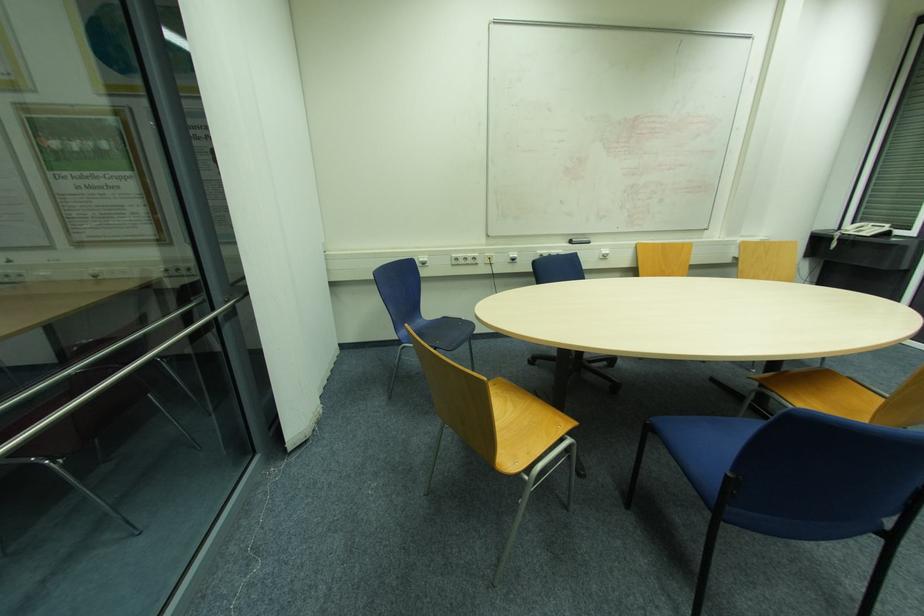
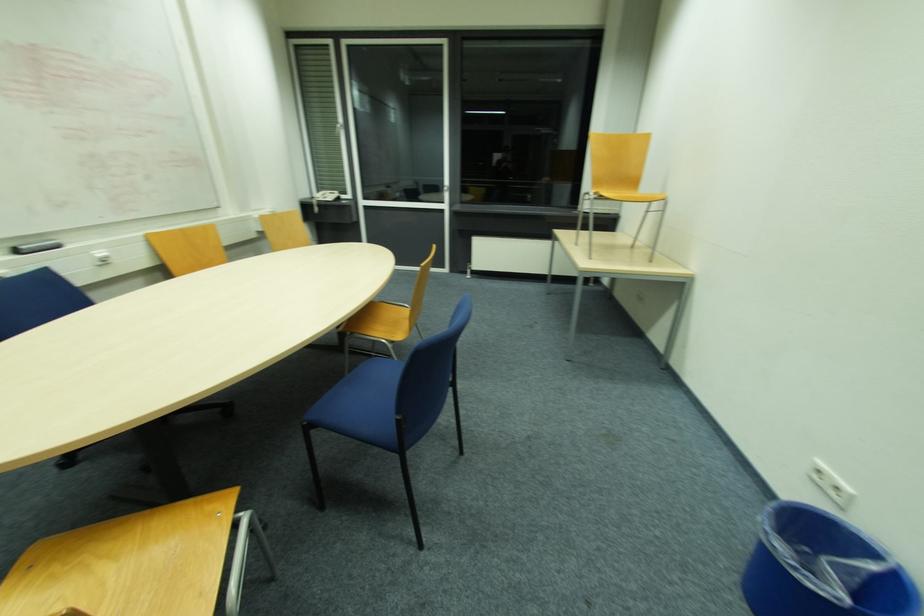
Based on the continuous images, in which direction is the camera rotating?

The camera's rotation is toward right-down.